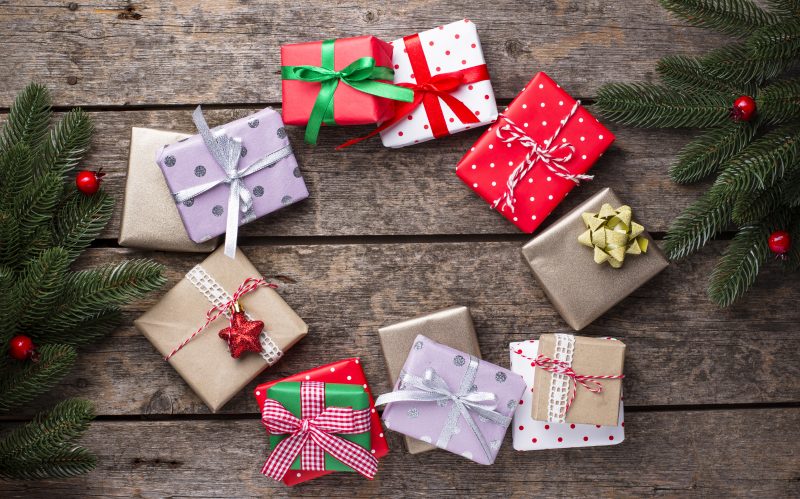
This screenshot has width=800, height=499. Identify the location of wooden planks. (436, 476), (354, 322), (386, 203), (225, 45).